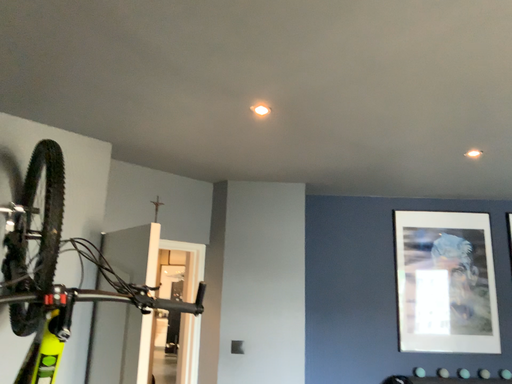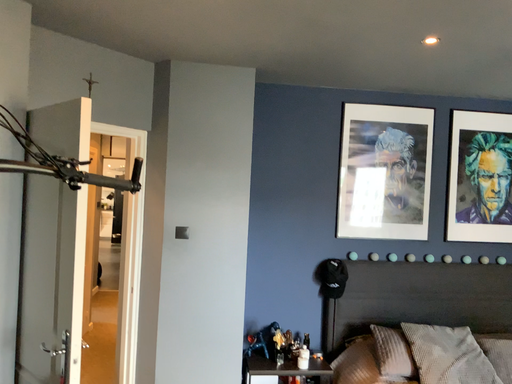
Question: Which way did the camera rotate in the video?

Choices:
 (A) rotated right
 (B) rotated left

Answer: (A)